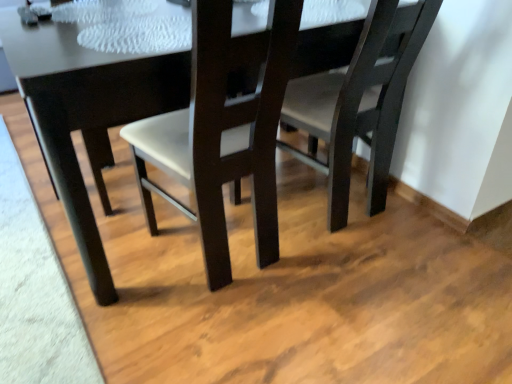
Where is `free space in front of matte dark wood chair at center, the second chair when ordered from right to left`? The image size is (512, 384). free space in front of matte dark wood chair at center, the second chair when ordered from right to left is located at coordinates (215, 338).